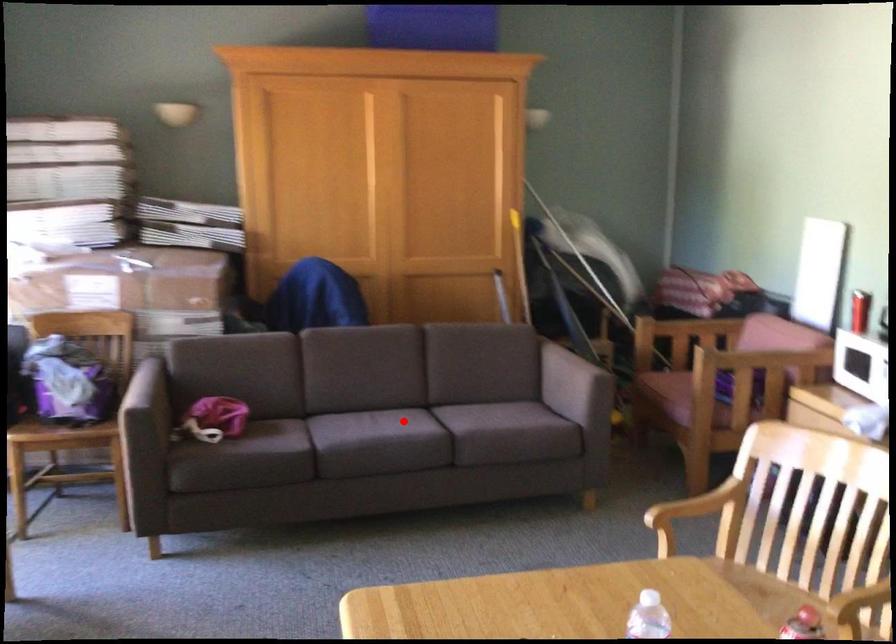
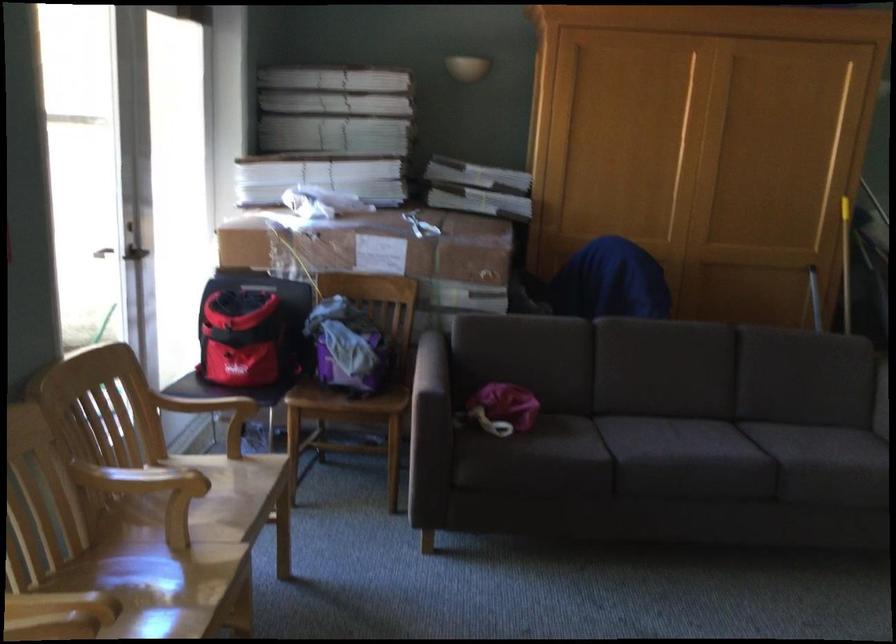
Where in the second image is the point corresponding to the highlighted location from the first image?

(724, 439)